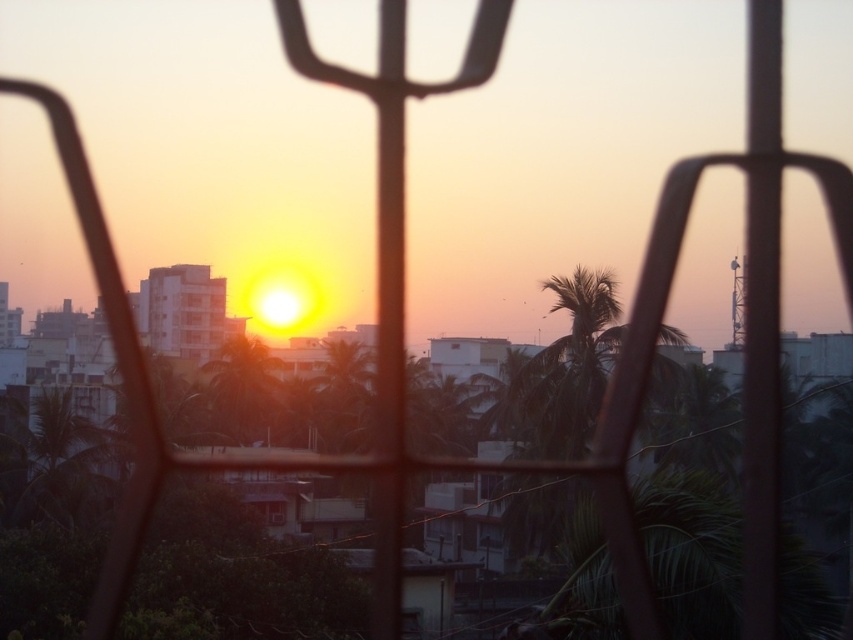
Question: Does green leafy palm tree at center lie in front of transparent glass window at center?

Choices:
 (A) no
 (B) yes

Answer: (A)

Question: Does green leafy palm tree at center have a smaller size compared to transparent glass window at center?

Choices:
 (A) yes
 (B) no

Answer: (B)

Question: Can you confirm if green leafy palm tree at center is positioned above transparent glass window at center?

Choices:
 (A) no
 (B) yes

Answer: (B)

Question: Which of the following is the closest to the observer?

Choices:
 (A) green leafy palm tree at center
 (B) transparent glass window at center

Answer: (B)

Question: Which of the following is the farthest from the observer?

Choices:
 (A) (265, 508)
 (B) (283, 406)

Answer: (B)